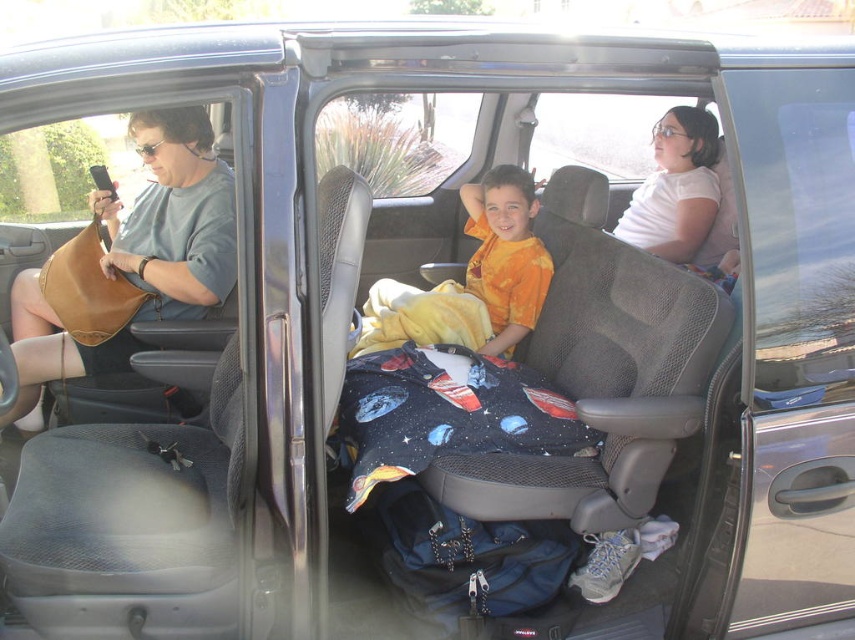
You are a delivery person who needs to place a small package between the leather handbag at left and the orange cotton shirt at center. Can you fit it there?

The leather handbag at left is larger than the orange cotton shirt at center. Since the handbag is bigger, there might be enough space between them to fit the small package.

You are a delivery person who needs to place a package between the leather handbag at left and the orange cotton shirt at center in the vehicle. The package measures 80 centimeters in length. Will it fit between them?

The distance between the leather handbag at left and the orange cotton shirt at center is 80.99 centimeters. Since the package is 80 centimeters long, it will fit with a small amount of space remaining.